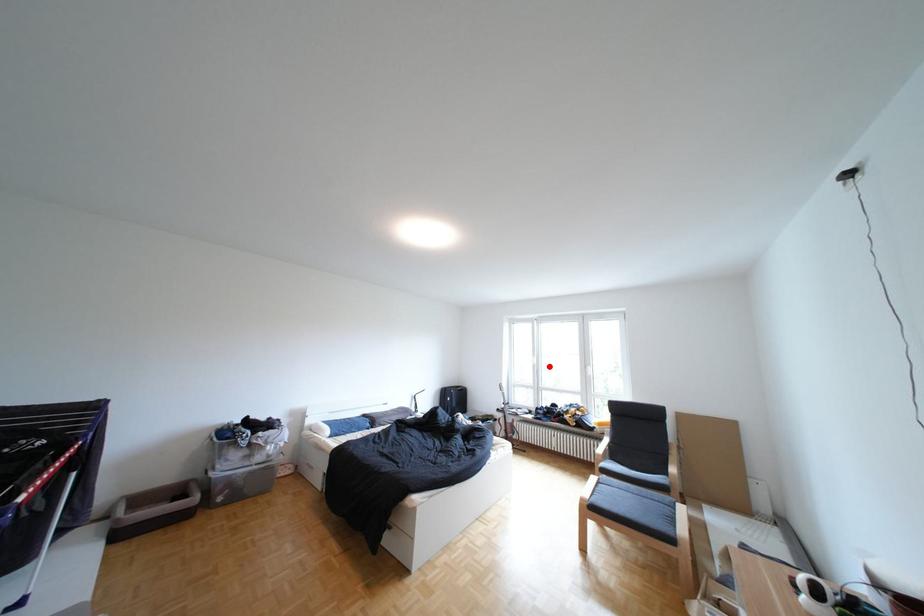
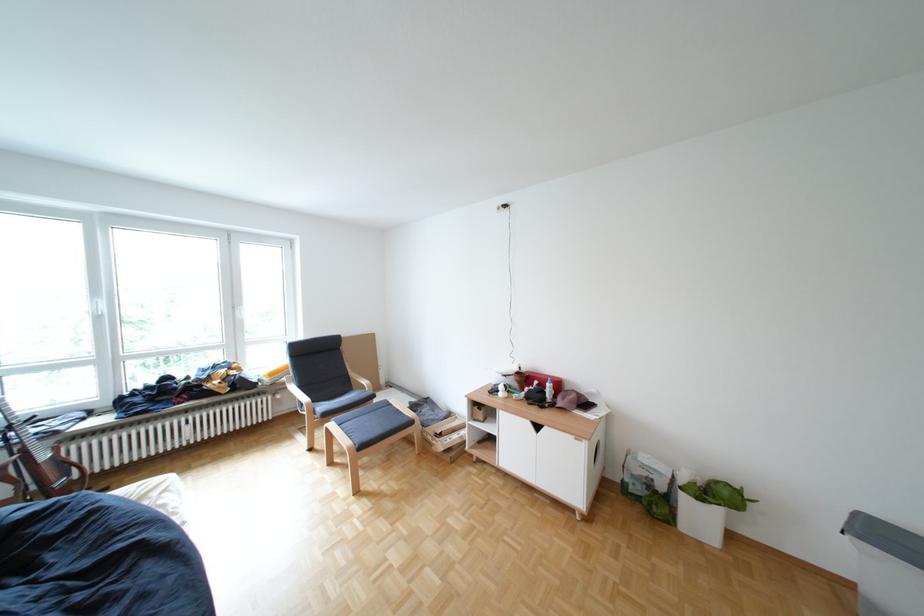
In the second image, find the point that corresponds to the highlighted location in the first image.

(114, 318)